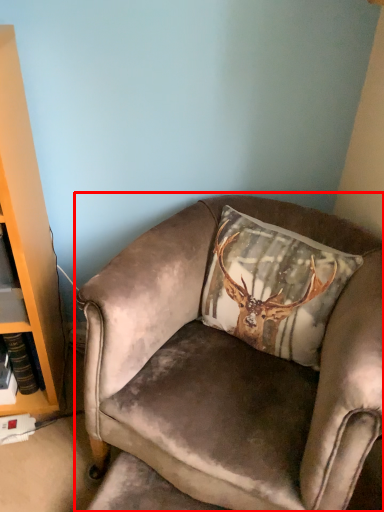
Question: From the image's perspective, where is chair (annotated by the red box) located relative to pillow?

Choices:
 (A) below
 (B) above

Answer: (A)